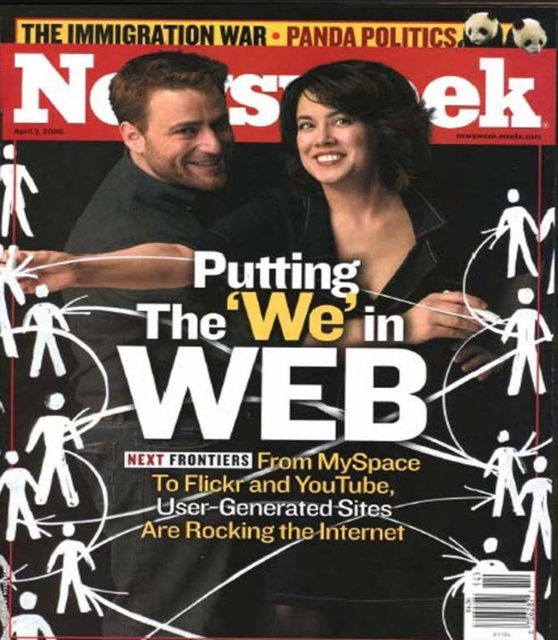
Question: Which point appears closest to the camera in this image?

Choices:
 (A) (84, 298)
 (B) (398, 304)

Answer: (A)

Question: Does black glossy hair at upper center have a lesser width compared to smooth black shirt at center?

Choices:
 (A) yes
 (B) no

Answer: (B)

Question: Which object appears closest to the camera in this image?

Choices:
 (A) black glossy hair at upper center
 (B) smooth black shirt at center

Answer: (B)

Question: Is black glossy hair at upper center below smooth black shirt at center?

Choices:
 (A) yes
 (B) no

Answer: (B)

Question: Is black glossy hair at upper center smaller than smooth black shirt at center?

Choices:
 (A) no
 (B) yes

Answer: (B)